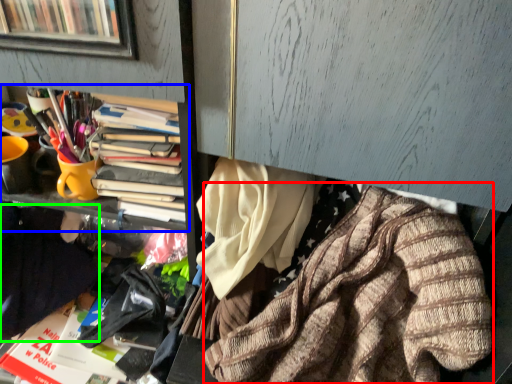
Question: Which is farther away from clothing (highlighted by a red box)? bookcase (highlighted by a blue box) or clothing (highlighted by a green box)?

Choices:
 (A) bookcase
 (B) clothing

Answer: (B)